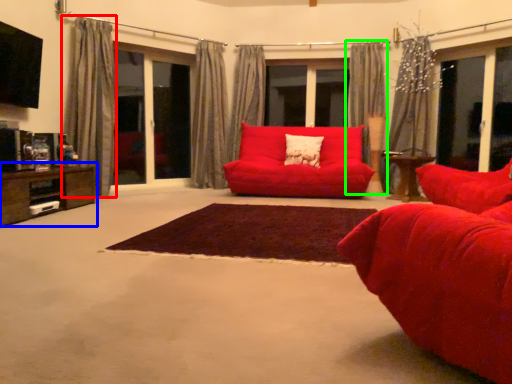
Question: Which object is the farthest from curtain (highlighted by a red box)? Choose among these: table (highlighted by a blue box) or curtain (highlighted by a green box).

Choices:
 (A) table
 (B) curtain

Answer: (B)